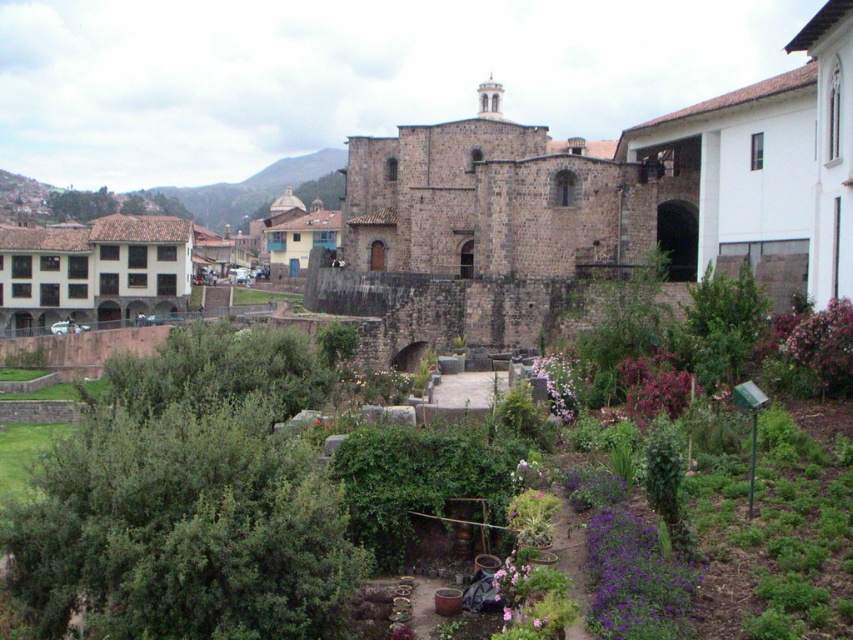
Which is below, brown stone wall at center or brown stone castle at center?

Positioned lower is brown stone castle at center.

Which is in front, point (467, 230) or point (564, 275)?

Point (564, 275)

Who is more distant from viewer, (538, 273) or (390, 346)?

Point (538, 273)

This screenshot has height=640, width=853. What are the coordinates of `brown stone wall at center` in the screenshot? It's located at (595, 208).

Who is more forward, (770, 148) or (33, 502)?

Positioned in front is point (33, 502).

Who is more distant from viewer, (312, 298) or (241, 541)?

Point (312, 298)

Is point (463, 120) behind point (323, 634)?

That is True.

The image size is (853, 640). Find the location of `brown stone wall at center`. brown stone wall at center is located at coordinates (595, 208).

Is green leafy garden at center bigger than green grassy hillside at upper left?

Actually, green leafy garden at center might be smaller than green grassy hillside at upper left.

How much distance is there between green leafy garden at center and green grassy hillside at upper left?

green leafy garden at center is 307.97 meters away from green grassy hillside at upper left.

Is point (239, 548) positioned before point (239, 193)?

Yes, it is.

Identify the location of green leafy garden at center. The height and width of the screenshot is (640, 853). (184, 524).